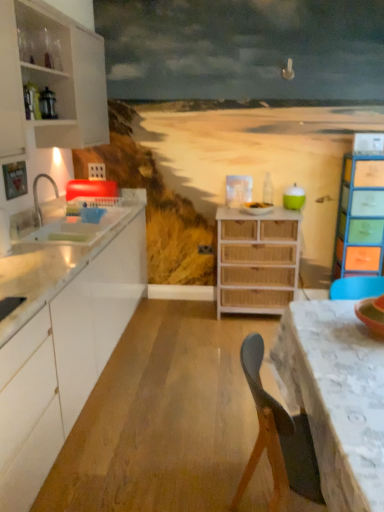
You are a GUI agent. You are given a task and a screenshot of the screen. Output one action in this format:
    pyautogui.click(x=<x>, y=<y>)
    Task: Click on the free space in front of woven wood chest of drawers at center, which is the first chest of drawers from left to right
    This screenshot has width=384, height=512.
    Given the screenshot: What is the action you would take?
    pyautogui.click(x=230, y=337)